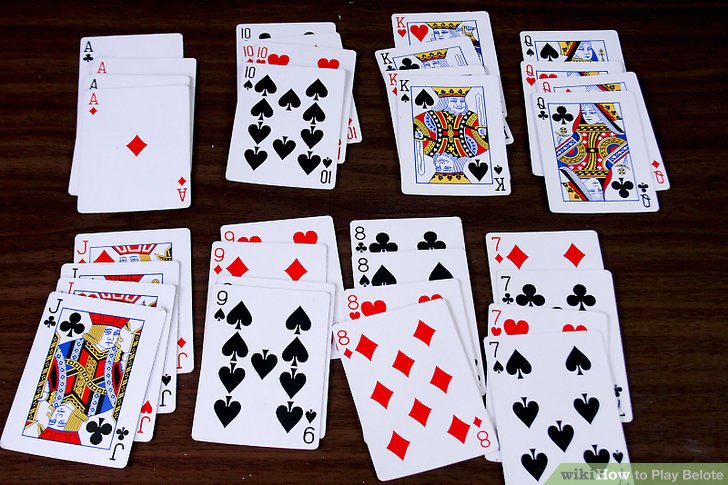
I want to click on wooden tabletop, so [x=28, y=99].